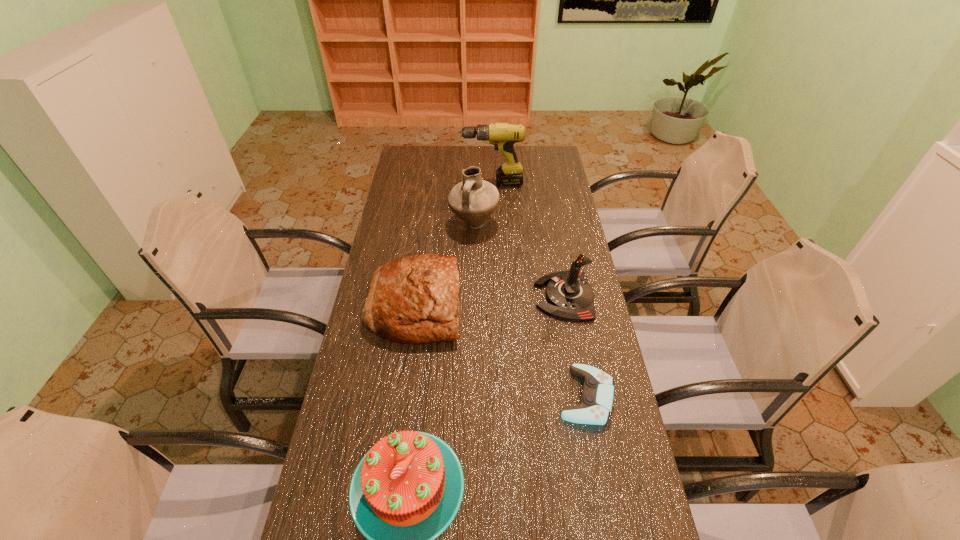
Locate an element on the screen. The width and height of the screenshot is (960, 540). vacant area located on the handle side of the joystick is located at coordinates (479, 296).

You are a GUI agent. You are given a task and a screenshot of the screen. Output one action in this format:
    pyautogui.click(x=<x>, y=<y>)
    Task: Click on the blank area located on the handle side of the joystick
    This screenshot has height=540, width=960.
    Given the screenshot: What is the action you would take?
    pyautogui.click(x=465, y=296)

At what (x,y) coordinates should I click in order to perform the action: click on free space located 0.300m on the handle side of the joystick. Please return your answer as a coordinate pair (x, y). The height and width of the screenshot is (540, 960). Looking at the image, I should click on (446, 296).

Identify the location of vacant space located at the sliced front of the bread. Image resolution: width=960 pixels, height=540 pixels. (540, 306).

This screenshot has height=540, width=960. What are the coordinates of `blank area located on the back of the second nearest object` in the screenshot? It's located at click(x=567, y=294).

Locate an element on the screen. object positioned at the left edge is located at coordinates (415, 299).

Locate an element on the screen. The image size is (960, 540). joystick at the right edge is located at coordinates (570, 297).

At what (x,y) coordinates should I click in order to perform the action: click on control located at the right edge. Please return your answer as a coordinate pair (x, y). Image resolution: width=960 pixels, height=540 pixels. Looking at the image, I should click on (595, 406).

The width and height of the screenshot is (960, 540). I want to click on vacant space at the far edge, so click(444, 159).

Locate an element on the screen. free space at the left edge is located at coordinates (382, 339).